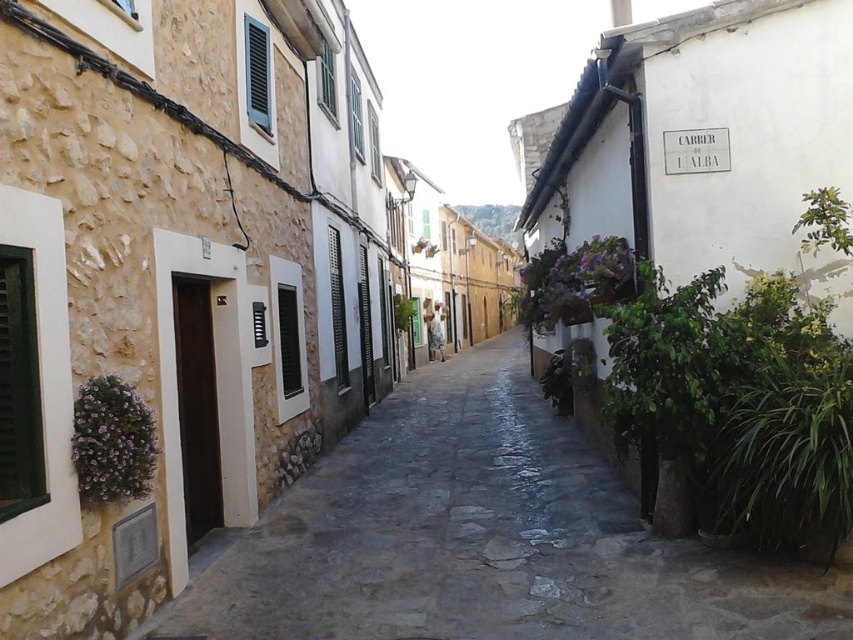
Between point (695, 445) and point (27, 486), which one is positioned behind?

Point (695, 445)

Who is positioned more to the right, green leafy plant at right or green textured shutter at left?

green leafy plant at right is more to the right.

Where is `green leafy plant at right`? green leafy plant at right is located at coordinates pyautogui.click(x=723, y=390).

Image resolution: width=853 pixels, height=640 pixels. I want to click on green leafy plant at right, so click(x=723, y=390).

Who is more forward, (258, 28) or (358, 280)?

Point (258, 28) is more forward.

Is point (268, 120) positioned in front of point (358, 257)?

Yes, it is.

Locate an element on the screen. blue painted wood shutter at upper center is located at coordinates (257, 74).

Is green leafy plant at right positioned before green leafy plant at center?

Yes.

Who is shorter, green leafy plant at right or green leafy plant at center?

Standing shorter between the two is green leafy plant at center.

Is point (537, 264) closer to viewer compared to point (399, 308)?

Yes, it is in front of point (399, 308).

You are a GUI agent. You are given a task and a screenshot of the screen. Output one action in this format:
    pyautogui.click(x=<x>, y=<y>)
    Task: Click on the green leafy plant at right
    The image size is (853, 640).
    Given the screenshot: What is the action you would take?
    pyautogui.click(x=723, y=390)